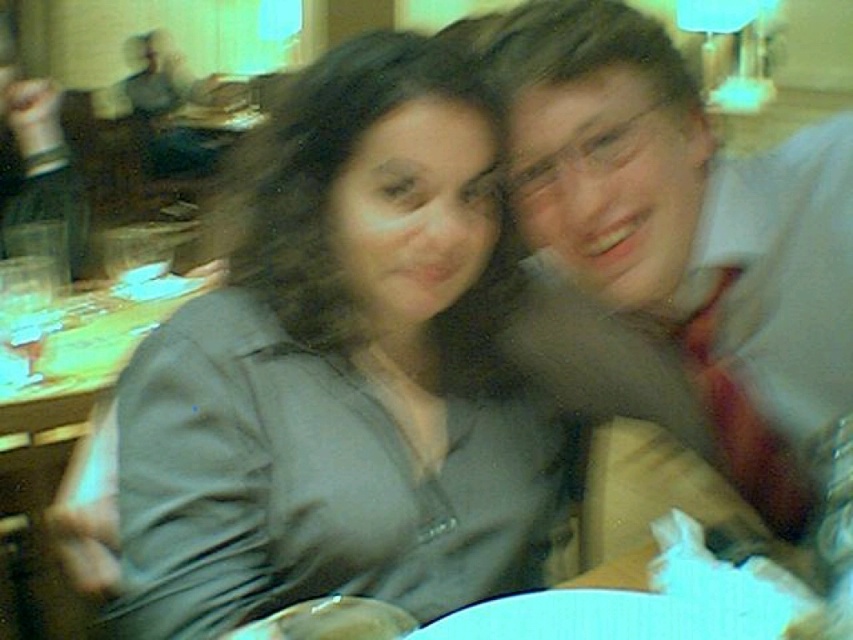
Between point (196, 572) and point (833, 268), which one is positioned in front?

Point (196, 572) is in front.

Is the position of matte gray shirt at center more distant than that of matte white shirt at upper right?

Yes, it is.

This screenshot has width=853, height=640. In order to click on matte gray shirt at center in this screenshot , I will do `click(341, 369)`.

Where is `matte gray shirt at center`? The height and width of the screenshot is (640, 853). matte gray shirt at center is located at coordinates (341, 369).

Does point (328, 442) come behind point (73, 378)?

That is False.

From the picture: Between matte gray shirt at center and wooden table at lower left, which one is positioned lower?

matte gray shirt at center

Is point (561, 484) positioned in front of point (22, 388)?

Yes.

At what (x,y) coordinates should I click in order to perform the action: click on matte gray shirt at center. Please return your answer as a coordinate pair (x, y). Looking at the image, I should click on (341, 369).

Based on the photo, is matte white shirt at upper right positioned before wooden table at lower left?

That is True.

Identify the location of matte white shirt at upper right. The width and height of the screenshot is (853, 640). (697, 244).

Between point (775, 396) and point (73, 385), which one is positioned in front?

Point (775, 396) is in front.

Identify the location of matte white shirt at upper right. (697, 244).